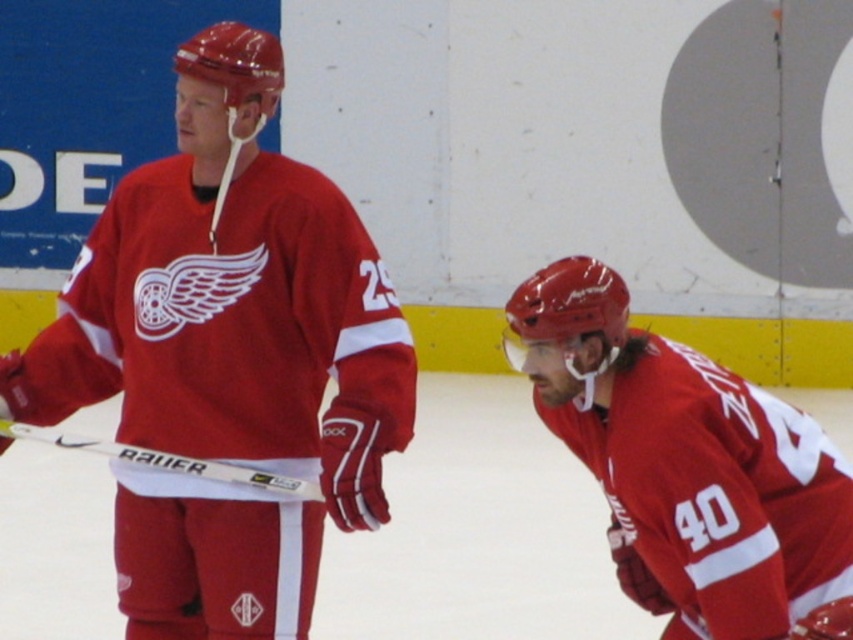
Looking at this image, you are an ice hockey coach observing the practice session. You notice the matte jersey at center and the white matte hockey stick at left. Which object is located more to the right side of the rink?

The matte jersey at center is positioned on the right side of the white matte hockey stick at left, so the matte jersey at center is more to the right side of the rink.

You are a referee standing at the edge of the ice rink. You need to determine which object is closer to you between the matte jersey at center and the white matte hockey stick at left. Based on the scene, which one is closer?

The matte jersey at center is closer to you because it is in front of the white matte hockey stick at left.